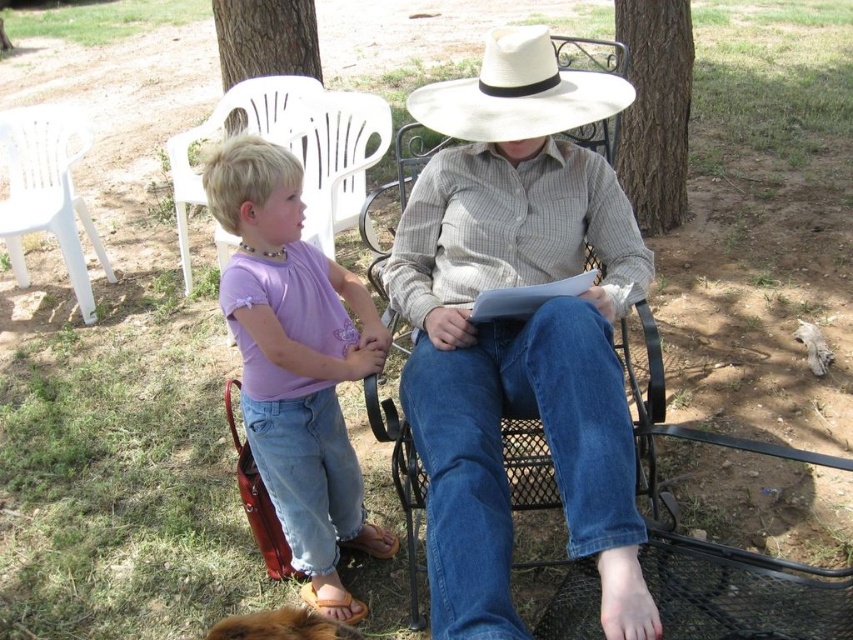
Does purple cotton shirt at left appear under white felt cowboy hat at center?

Yes.

Does purple cotton shirt at left appear on the right side of white felt cowboy hat at center?

No, purple cotton shirt at left is not to the right of white felt cowboy hat at center.

Is point (334, 280) behind point (508, 128)?

Yes, it is behind point (508, 128).

Identify the location of purple cotton shirt at left. Image resolution: width=853 pixels, height=640 pixels. (296, 362).

Does matte brown shirt at center appear on the left side of white felt cowboy hat at center?

Correct, you'll find matte brown shirt at center to the left of white felt cowboy hat at center.

What do you see at coordinates (519, 332) in the screenshot? This screenshot has height=640, width=853. I see `matte brown shirt at center` at bounding box center [519, 332].

Locate an element on the screen. matte brown shirt at center is located at coordinates (519, 332).

Does matte brown shirt at center have a greater width compared to purple cotton shirt at left?

Indeed, matte brown shirt at center has a greater width compared to purple cotton shirt at left.

Is point (605, 237) positioned before point (320, 296)?

No, it is behind (320, 296).

Identify the location of matte brown shirt at center. This screenshot has width=853, height=640. (519, 332).